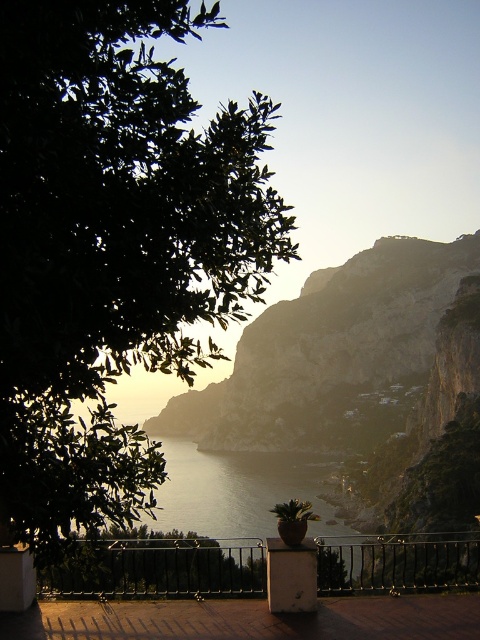
You are standing on the balcony and want to take a photo of the rugged stone mountain at center and the silvery reflective water at center. Which one should you focus on first if you want to capture both in one shot?

The rugged stone mountain at center is much taller than the silvery reflective water at center, so you should focus on the rugged stone mountain at center first to ensure it is in sharp focus before adjusting for the water.